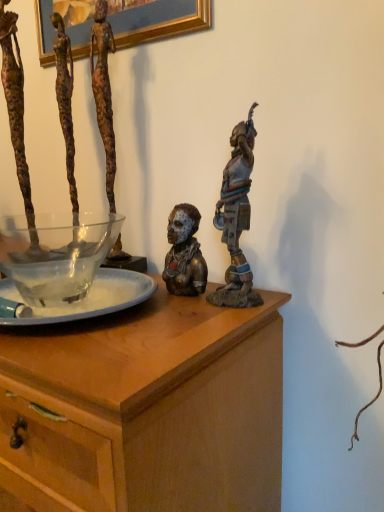
Question: From the image's perspective, is translucent glass bowl at center located above or below bronze statue at upper right, acting as the 1th person starting from the right?

Choices:
 (A) above
 (B) below

Answer: (B)

Question: Considering their positions, is translucent glass bowl at center located in front of or behind bronze statue at upper right, which ranks as the 4th person in left-to-right order?

Choices:
 (A) behind
 (B) front

Answer: (B)

Question: Which object is the farthest from the translucent glass bowl at center?

Choices:
 (A) wooden chest at center
 (B) transparent glass bowl at left
 (C) rusty metal sculpture at left, which ranks as the first person in left-to-right order
 (D) rusty metal figure at upper left, arranged as the second person when viewed from the left
 (E) bronze statue at center, the second person positioned from the right

Answer: (C)

Question: Which is farther from the translucent glass bowl at center?

Choices:
 (A) rusty metal sculpture at left, which is the 4th person in right-to-left order
 (B) bronze statue at center, acting as the third person starting from the left
 (C) transparent glass bowl at left
 (D) rusty metal figure at upper left, placed as the 3th person when sorted from right to left
 (E) bronze statue at upper right, which ranks as the 4th person in left-to-right order

Answer: (A)